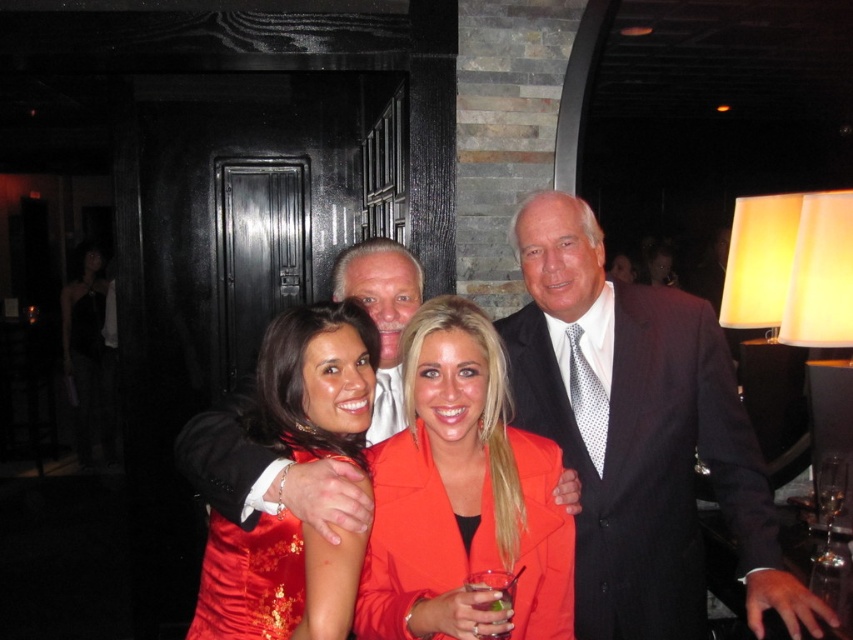
Is point (384, 516) farther from viewer compared to point (492, 576)?

Yes, point (384, 516) is behind point (492, 576).

Find the location of a particular element. The height and width of the screenshot is (640, 853). orange satin jacket at center is located at coordinates (462, 493).

Who is more forward, (544, 568) or (505, 605)?

Point (505, 605)

Image resolution: width=853 pixels, height=640 pixels. Find the location of `orange satin jacket at center`. orange satin jacket at center is located at coordinates (462, 493).

Does orange satin jacket at center have a larger size compared to clear glass wine glass at lower right?

Correct, orange satin jacket at center is larger in size than clear glass wine glass at lower right.

Can you confirm if orange satin jacket at center is thinner than clear glass wine glass at lower right?

In fact, orange satin jacket at center might be wider than clear glass wine glass at lower right.

Find the location of a particular element. The height and width of the screenshot is (640, 853). orange satin jacket at center is located at coordinates (462, 493).

Which is more to the right, dark suit at center or clear glass wine glass at lower right?

From the viewer's perspective, clear glass wine glass at lower right appears more on the right side.

Based on the photo, is dark suit at center below clear glass wine glass at lower right?

Incorrect, dark suit at center is not positioned below clear glass wine glass at lower right.

This screenshot has height=640, width=853. What do you see at coordinates (639, 435) in the screenshot?
I see `dark suit at center` at bounding box center [639, 435].

Locate an element on the screen. dark suit at center is located at coordinates (639, 435).